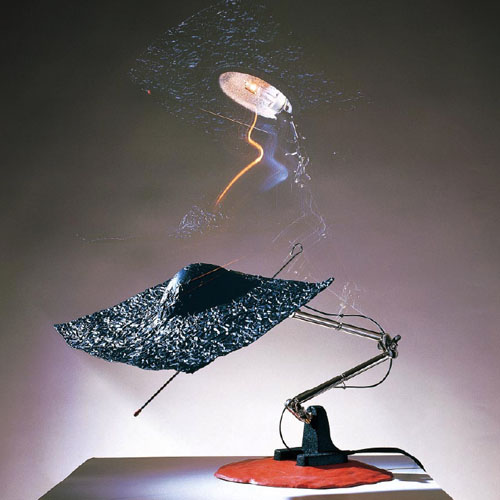
Where is `power cord`? Image resolution: width=500 pixels, height=500 pixels. power cord is located at coordinates (361, 450).